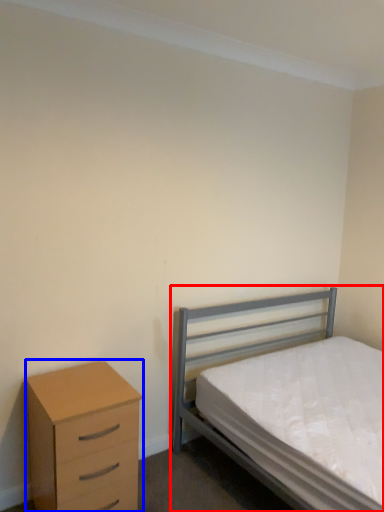
Question: Which of the following is the farthest to the observer, bed (highlighted by a red box) or chest of drawers (highlighted by a blue box)?

Choices:
 (A) bed
 (B) chest of drawers

Answer: (B)